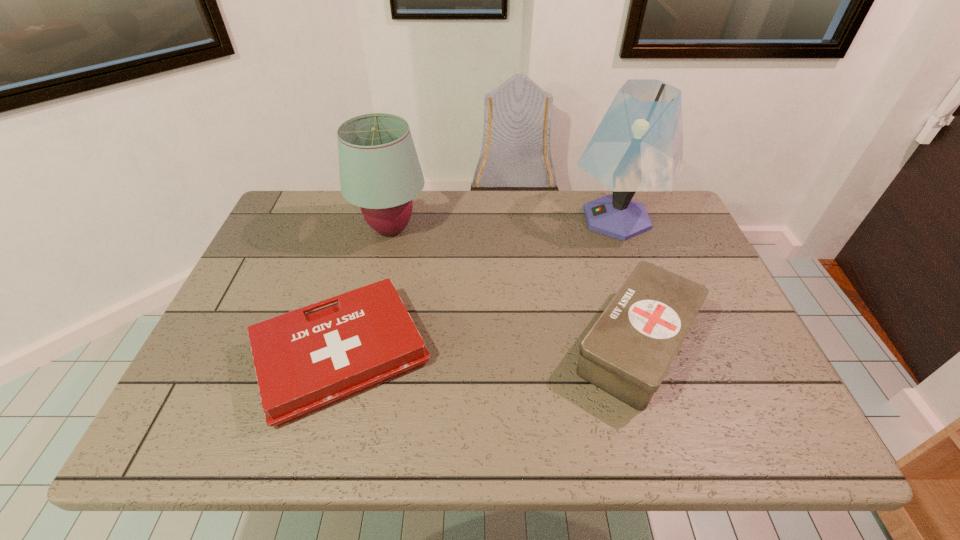
Locate an element on the screen. The image size is (960, 540). vacant space at the far edge of the desktop is located at coordinates (337, 210).

I want to click on vacant region at the near edge, so tap(601, 446).

Locate an element on the screen. vacant space at the left edge of the desktop is located at coordinates pyautogui.click(x=289, y=250).

This screenshot has width=960, height=540. In order to click on vacant space at the right edge of the desktop in this screenshot , I will do `click(700, 255)`.

Find the location of a particular element. free space at the far left corner of the desktop is located at coordinates coord(273,238).

This screenshot has height=540, width=960. I want to click on free spot between the right lampshade and the third shortest object, so click(504, 224).

Where is `vacant region between the tallest object and the shortest object`? vacant region between the tallest object and the shortest object is located at coordinates (479, 286).

The height and width of the screenshot is (540, 960). In order to click on vacant area that lies between the shorter lampshade and the right lampshade in this screenshot , I will do `click(504, 224)`.

The height and width of the screenshot is (540, 960). I want to click on free spot between the third shortest object and the tallest object, so (504, 224).

Where is `vacant space in between the right first-aid kit and the shorter lampshade`? The image size is (960, 540). vacant space in between the right first-aid kit and the shorter lampshade is located at coordinates (514, 287).